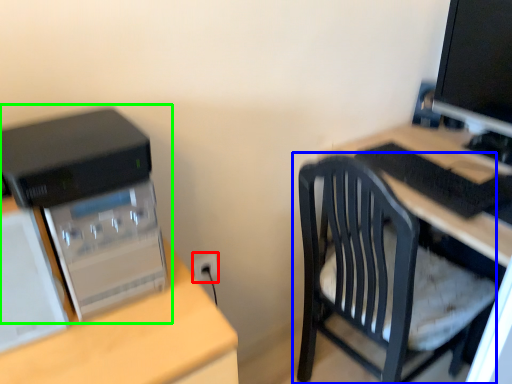
Question: Which object is positioned farthest from electric outlet (highlighted by a red box)? Select from chair (highlighted by a blue box) and computer tower (highlighted by a green box).

Choices:
 (A) chair
 (B) computer tower

Answer: (B)